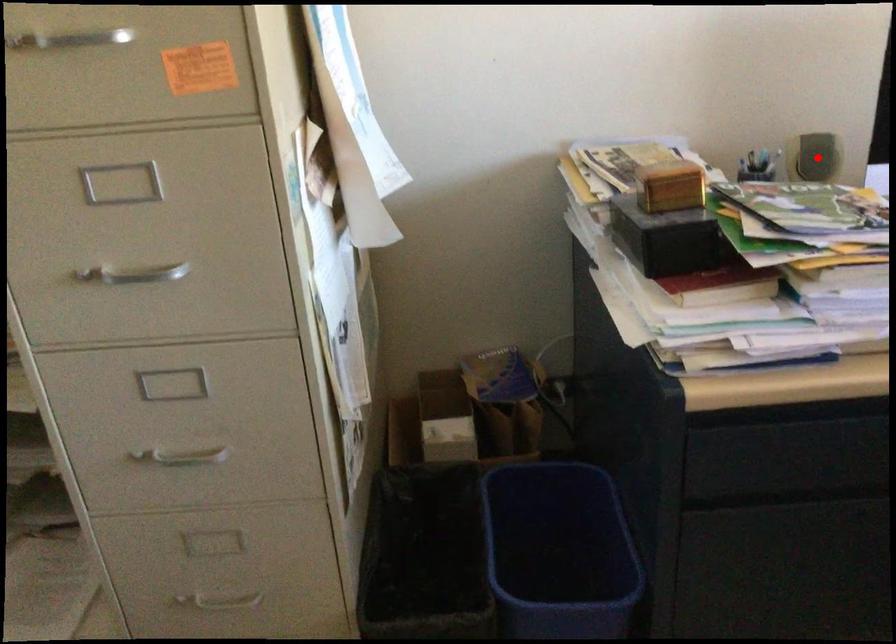
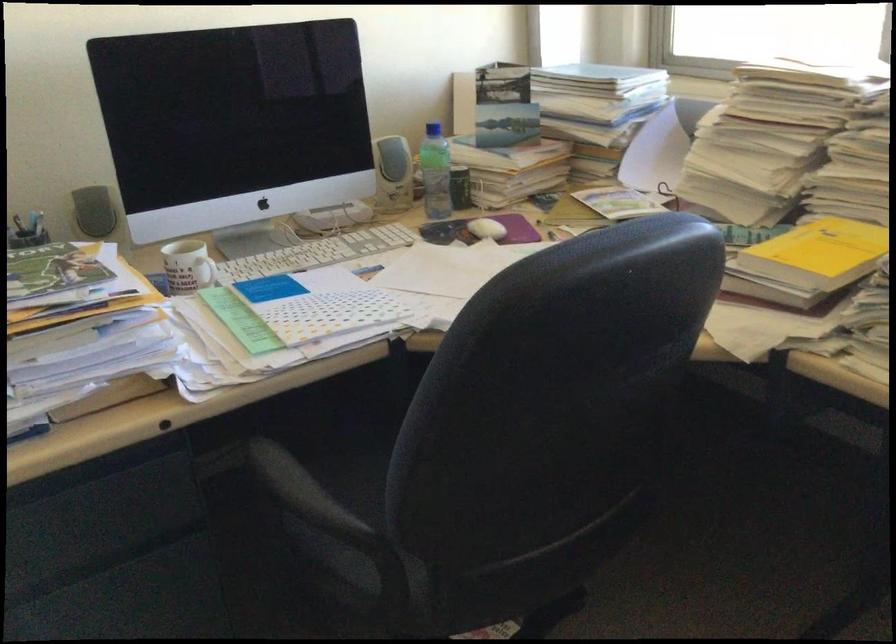
Locate, in the second image, the point that corresponds to the highlighted location in the first image.

(93, 211)